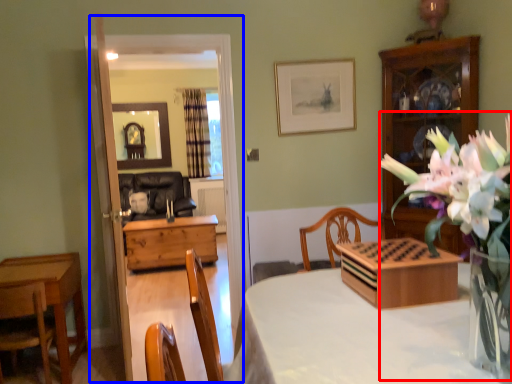
Question: Which object is closer to the camera taking this photo, floral arrangement (highlighted by a red box) or glass door (highlighted by a blue box)?

Choices:
 (A) floral arrangement
 (B) glass door

Answer: (A)